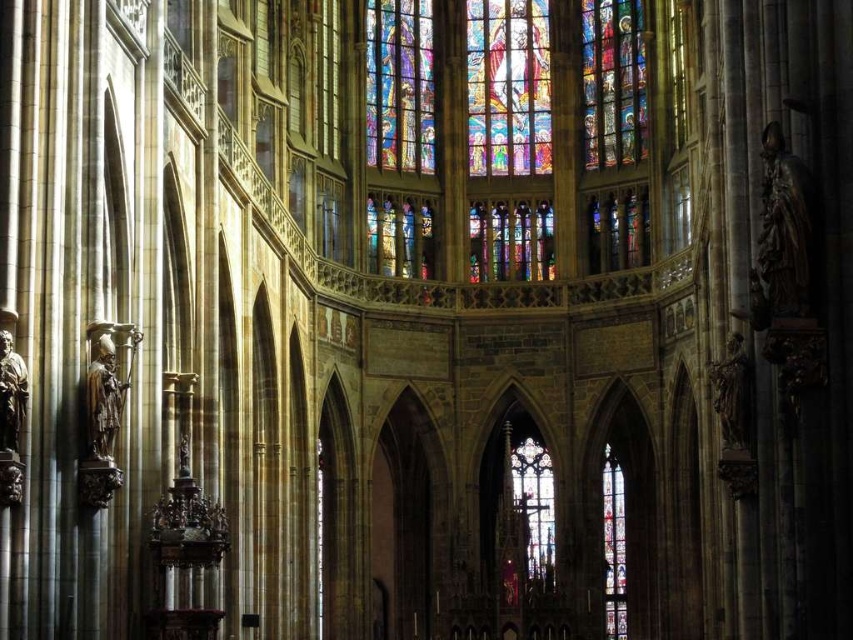
Does point (392, 104) come closer to viewer compared to point (607, 484)?

Yes, point (392, 104) is in front of point (607, 484).

Between point (370, 68) and point (613, 612), which one is positioned in front?

Positioned in front is point (370, 68).

Locate an element on the screen. multicolored stained glass window at center is located at coordinates (399, 84).

This screenshot has width=853, height=640. What do you see at coordinates (399, 84) in the screenshot?
I see `multicolored stained glass window at center` at bounding box center [399, 84].

Is point (407, 33) positioned after point (624, 83)?

Yes, point (407, 33) is farther from viewer.

The height and width of the screenshot is (640, 853). In order to click on multicolored stained glass window at center in this screenshot , I will do `click(399, 84)`.

Is multicolored stained glass window at upper right to the left of stained glass window at center from the viewer's perspective?

Indeed, multicolored stained glass window at upper right is positioned on the left side of stained glass window at center.

Which of these two, multicolored stained glass window at upper right or stained glass window at center, stands taller?

Standing taller between the two is stained glass window at center.

Locate an element on the screen. multicolored stained glass window at upper right is located at coordinates (612, 83).